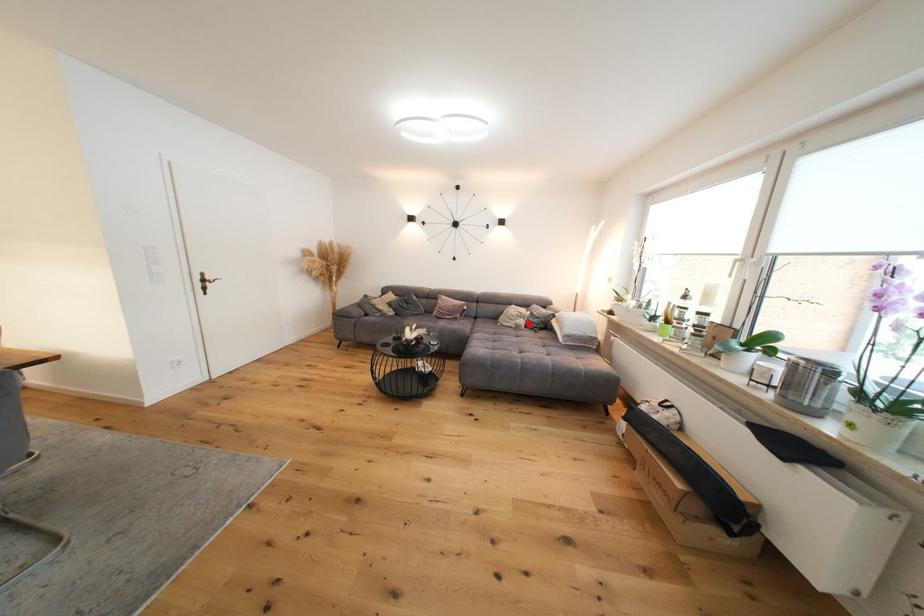
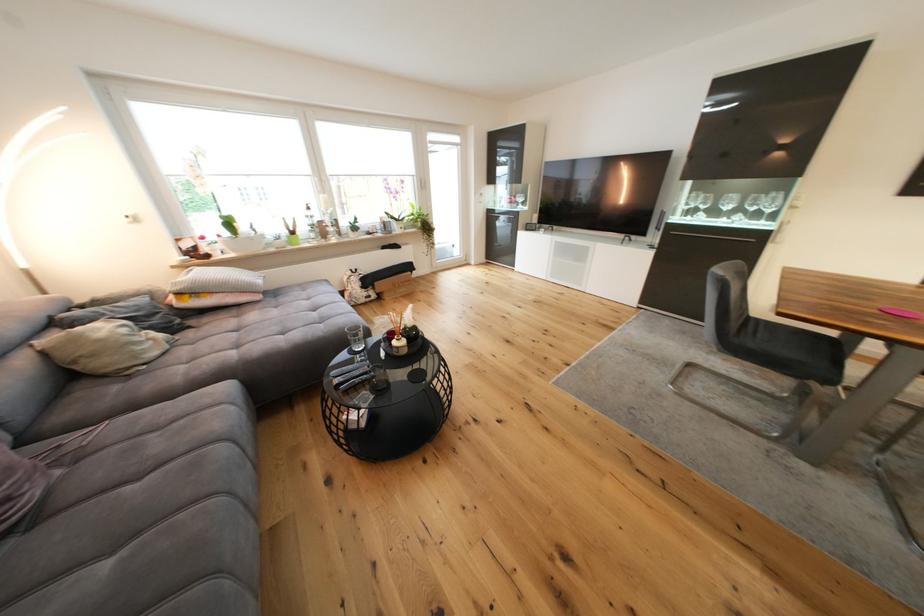
The point at the highlighted location is marked in the first image. Where is the corresponding point in the second image?

(161, 336)